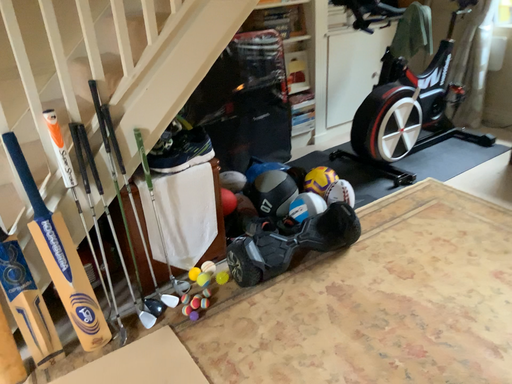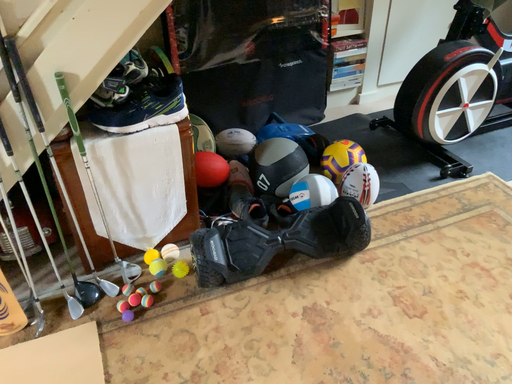
Question: How did the camera likely rotate when shooting the video?

Choices:
 (A) rotated downward
 (B) rotated upward

Answer: (A)